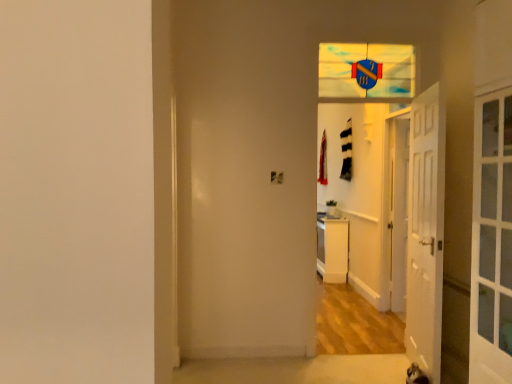
Identify the location of vacant region to the left of white wooden door at right, acting as the 1th door starting from the left. (375, 374).